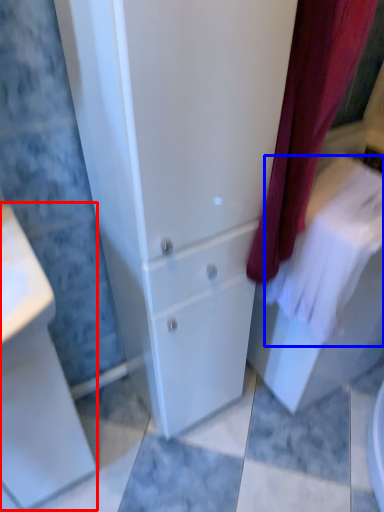
Question: Among these objects, which one is farthest to the camera, porcelain (highlighted by a red box) or bath towel (highlighted by a blue box)?

Choices:
 (A) porcelain
 (B) bath towel

Answer: (B)